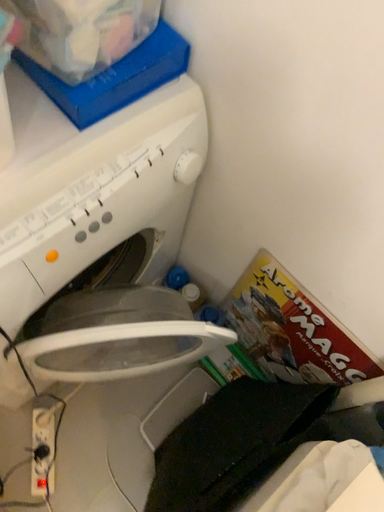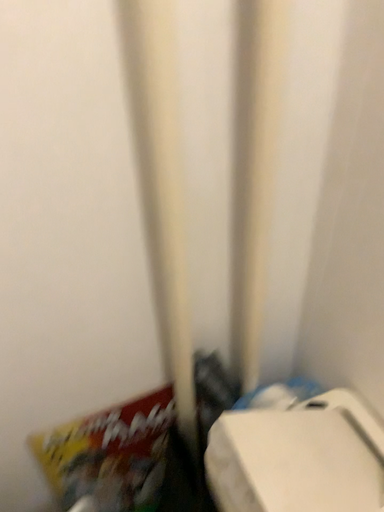
Question: Which way did the camera rotate in the video?

Choices:
 (A) rotated left
 (B) rotated right

Answer: (B)